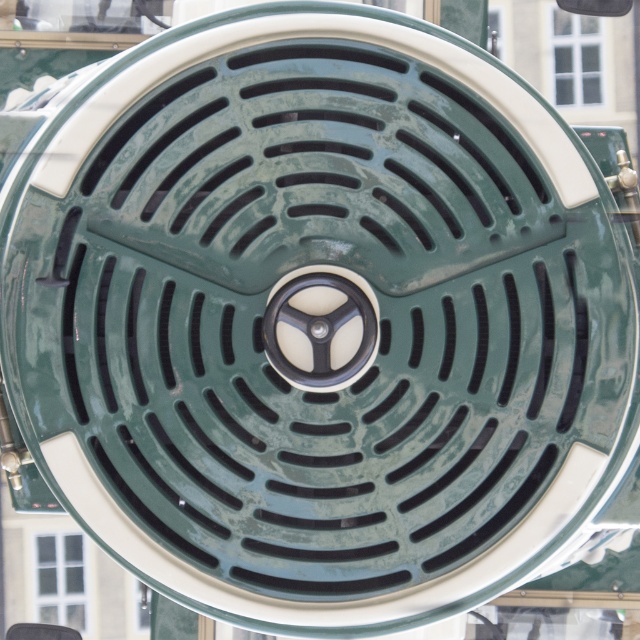
You are a mechanic inspecting a vintage vehicle. You notice two windows on the vent grille. Which window is narrower? The transparent glass window at lower left or the clear glass window at upper center?

The transparent glass window at lower left has a lesser width compared to the clear glass window at upper center, so the transparent glass window at lower left is narrower.

You are examining the circular vent and notice a transparent glass window at lower left. Based on its position, can you determine if it is closer to the edge or the center of the vent?

The transparent glass window at lower left is located at point coordinates that are closer to the edge of the vent, so it is positioned nearer to the edge rather than the center.